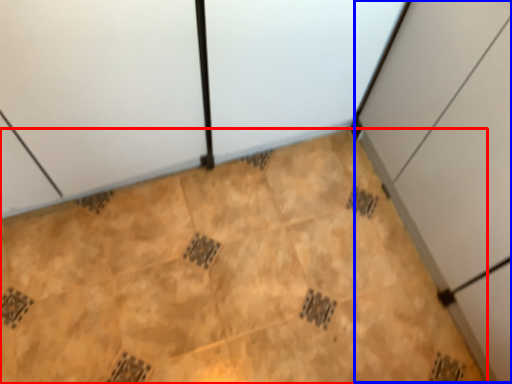
Question: Which of the following is the farthest to the observer, ceramic tile (highlighted by a red box) or cabinetry (highlighted by a blue box)?

Choices:
 (A) ceramic tile
 (B) cabinetry

Answer: (A)